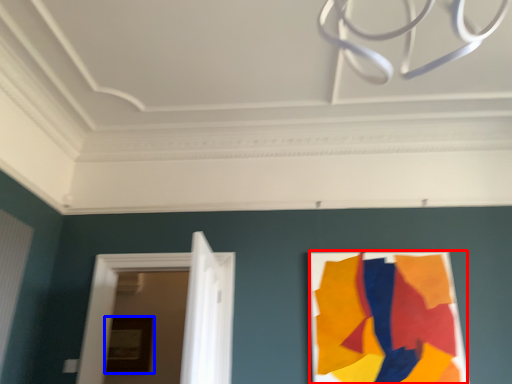
Question: Which of the following is the closest to the observer, poster (highlighted by a red box) or picture frame (highlighted by a blue box)?

Choices:
 (A) poster
 (B) picture frame

Answer: (A)